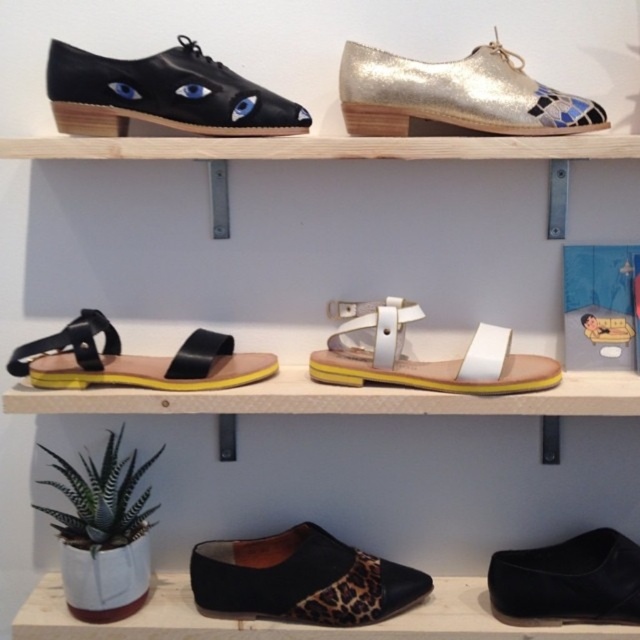
Question: Which is farther from the black leather sandal at lower left?

Choices:
 (A) black leather shoe at upper left
 (B) glittery metallic shoe at upper center

Answer: (B)

Question: Is glittery metallic shoe at upper center above black leather sandal at lower left?

Choices:
 (A) yes
 (B) no

Answer: (A)

Question: Does black leather shoe at upper left have a greater width compared to leopard print fabric slip-on at lower center?

Choices:
 (A) yes
 (B) no

Answer: (B)

Question: Is glittery metallic shoe at upper center smaller than black leather sandal at lower left?

Choices:
 (A) yes
 (B) no

Answer: (A)

Question: Which object is positioned closest to the black leather shoe at lower right?

Choices:
 (A) black leather shoe at upper left
 (B) leopard print fabric slip-on at lower center

Answer: (B)

Question: Estimate the real-world distances between objects in this image. Which object is farther from the white leather sandal at center?

Choices:
 (A) glittery metallic shoe at upper center
 (B) black leather shoe at lower right
 (C) black leather sandal at lower left

Answer: (B)